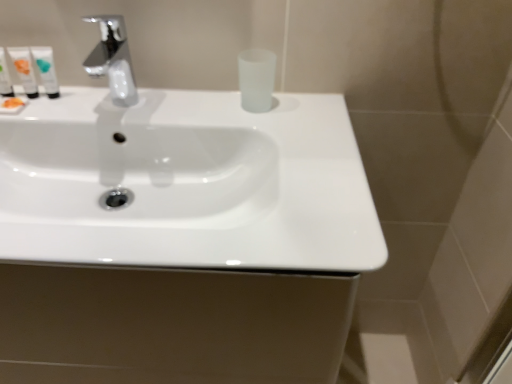
Question: Can you confirm if white glossy tube at upper left, the 2th mouthwash viewed from the left, is thinner than white glossy sink at center?

Choices:
 (A) yes
 (B) no

Answer: (A)

Question: Is white glossy tube at upper left, marked as the 3th mouthwash in a right-to-left arrangement, not within white glossy sink at center?

Choices:
 (A) no
 (B) yes

Answer: (B)

Question: From the image's perspective, is white glossy tube at upper left, marked as the 3th mouthwash in a right-to-left arrangement, over white glossy sink at center?

Choices:
 (A) no
 (B) yes

Answer: (B)

Question: Are white glossy tube at upper left, the 2th mouthwash viewed from the left, and white glossy sink at center beside each other?

Choices:
 (A) yes
 (B) no

Answer: (B)

Question: From a real-world perspective, is white glossy tube at upper left, marked as the 3th mouthwash in a right-to-left arrangement, located beneath white glossy sink at center?

Choices:
 (A) yes
 (B) no

Answer: (B)

Question: Considering the relative sizes of white glossy tube at upper left, marked as the 3th mouthwash in a right-to-left arrangement, and white glossy sink at center in the image provided, is white glossy tube at upper left, marked as the 3th mouthwash in a right-to-left arrangement, bigger than white glossy sink at center?

Choices:
 (A) no
 (B) yes

Answer: (A)

Question: Is chrome metallic faucet at upper left not near white glossy tube at upper left, positioned as the third mouthwash in left-to-right order?

Choices:
 (A) yes
 (B) no

Answer: (B)

Question: Considering the relative sizes of chrome metallic faucet at upper left and white glossy tube at upper left, the 2th mouthwash positioned from the right, in the image provided, is chrome metallic faucet at upper left smaller than white glossy tube at upper left, the 2th mouthwash positioned from the right,?

Choices:
 (A) no
 (B) yes

Answer: (A)

Question: Considering the relative sizes of chrome metallic faucet at upper left and white glossy tube at upper left, the 2th mouthwash positioned from the right, in the image provided, is chrome metallic faucet at upper left thinner than white glossy tube at upper left, the 2th mouthwash positioned from the right,?

Choices:
 (A) yes
 (B) no

Answer: (B)

Question: Is chrome metallic faucet at upper left not within white glossy tube at upper left, positioned as the third mouthwash in left-to-right order?

Choices:
 (A) yes
 (B) no

Answer: (A)

Question: Considering the relative sizes of chrome metallic faucet at upper left and white glossy tube at upper left, positioned as the third mouthwash in left-to-right order, in the image provided, is chrome metallic faucet at upper left wider than white glossy tube at upper left, positioned as the third mouthwash in left-to-right order,?

Choices:
 (A) yes
 (B) no

Answer: (A)

Question: Can you confirm if chrome metallic faucet at upper left is shorter than white glossy tube at upper left, positioned as the third mouthwash in left-to-right order?

Choices:
 (A) no
 (B) yes

Answer: (A)

Question: Could you tell me if white glossy sink at center is facing chrome metallic faucet at upper left?

Choices:
 (A) yes
 (B) no

Answer: (B)